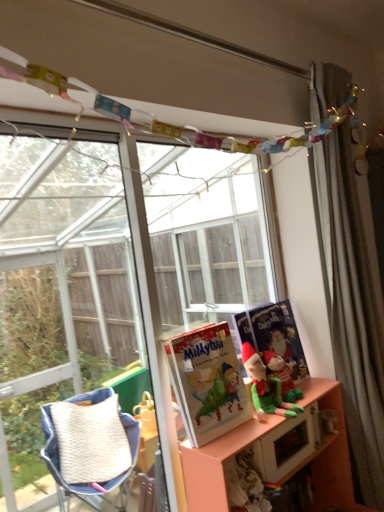
Question: Looking at their shapes, would you say matte paper book at center is wider or thinner than matte blue paperback book at right?

Choices:
 (A) thin
 (B) wide

Answer: (B)

Question: Is matte paper book at center in front of or behind matte blue paperback book at right in the image?

Choices:
 (A) front
 (B) behind

Answer: (A)

Question: Which of these objects is positioned closest to the pink matte shelf at lower right?

Choices:
 (A) green fabric elf at center
 (B) silky gray curtain at right
 (C) matte blue paperback book at right
 (D) transparent glass window at upper center
 (E) matte paper book at center

Answer: (A)

Question: Which of these objects is positioned closest to the pink matte shelf at lower right?

Choices:
 (A) transparent glass window at upper center
 (B) matte blue paperback book at right
 (C) green fabric elf at center
 (D) silky gray curtain at right
 (E) matte paper book at center

Answer: (C)